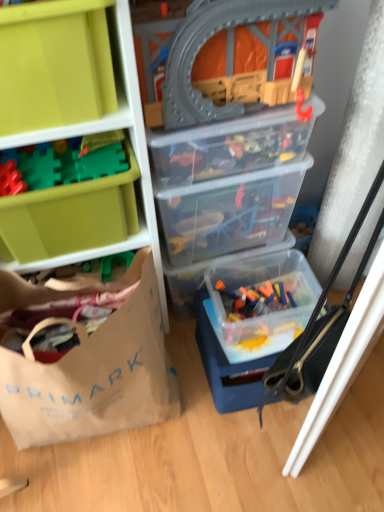
Find the location of a particular element. This screenshot has width=384, height=512. vacant region in front of brown paper bag at lower left is located at coordinates (103, 482).